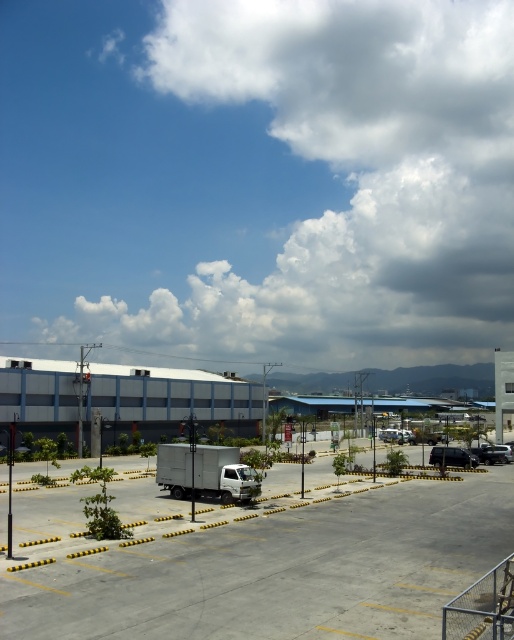
You are standing in the parking lot and looking up at the sky. There is a point marked at coordinates (340, 179). What object is located at that point?

The point at coordinates (340, 179) marks the location of the white fluffy cloud at upper center.

You are a delivery driver who needs to back out of the parking lot. You see the gray matte truck at center and the silver metallic sedan at center. Which vehicle should you avoid hitting first when reversing?

The gray matte truck at center is in front of the silver metallic sedan at center, so you should avoid hitting the gray matte truck at center first when reversing.

You are standing in the parking lot and want to locate a specific point for maintenance. The point is labeled as point (179, 483). Considering the parking lot layout described, can you determine if this point is within the boundaries of the parking lot?

The point (179, 483) is 116.93 feet from the camera. Since the parking lot is described as wide and open with yellow lines indicating parking spaces and curbs, and the point is within the visible area, it is likely within the parking lot boundaries.